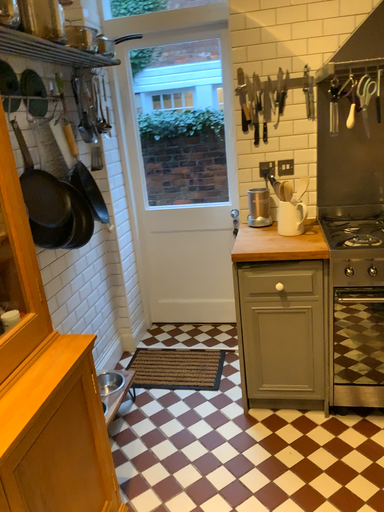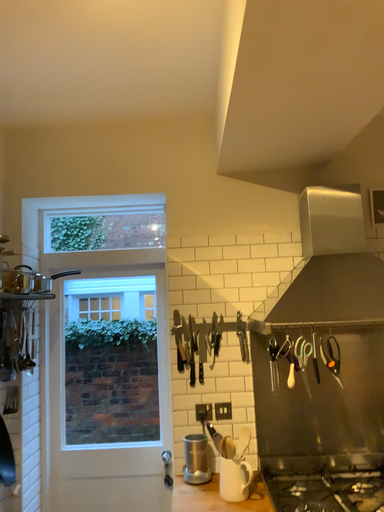
Question: How did the camera likely rotate when shooting the video?

Choices:
 (A) rotated upward
 (B) rotated downward

Answer: (A)